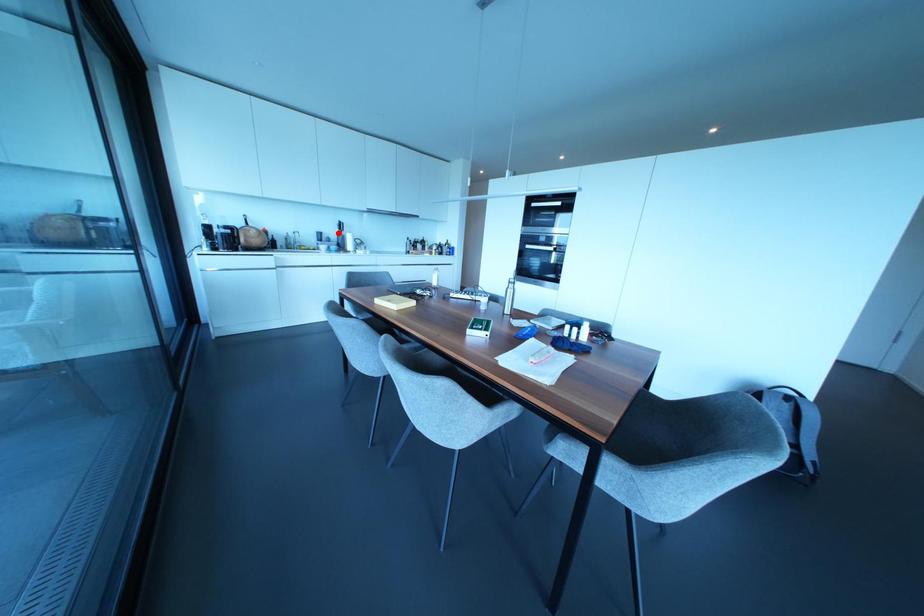
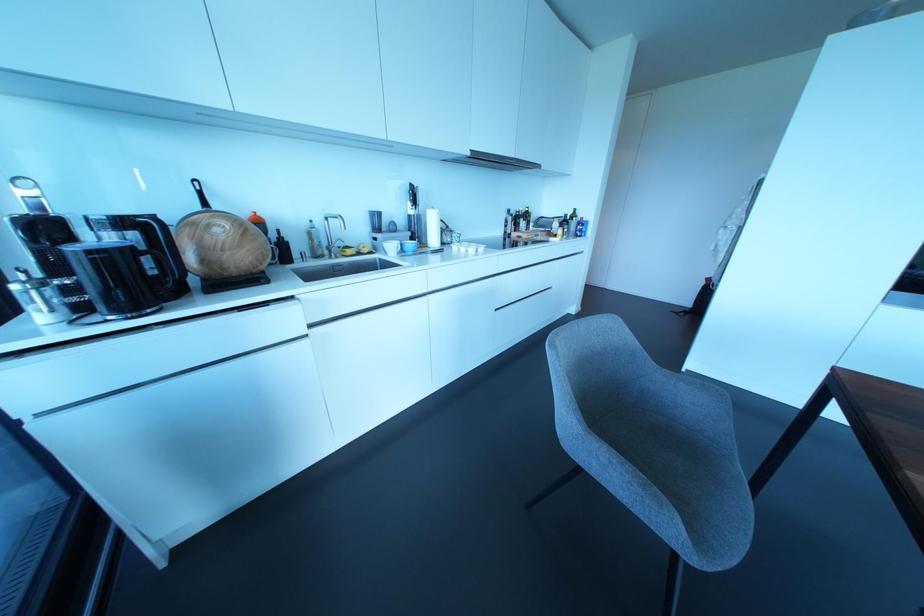
Where in the second image is the point corresponding to the highlighted location from the first image?

(410, 211)